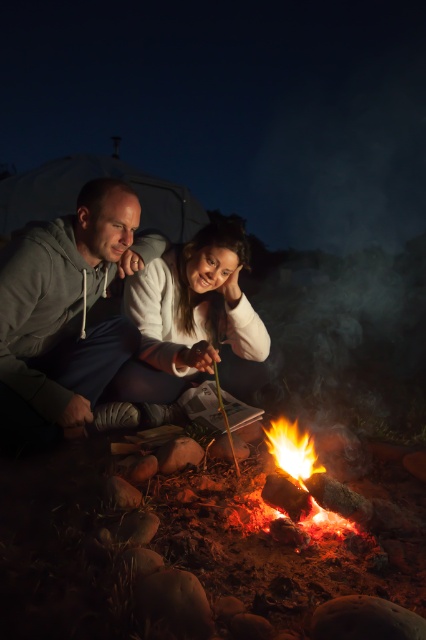
Question: Among these objects, which one is nearest to the camera?

Choices:
 (A) flaming wood at center
 (B) gray hoodie at left

Answer: (A)

Question: Is gray hoodie at left closer to the viewer compared to white soft sweater at center?

Choices:
 (A) yes
 (B) no

Answer: (A)

Question: Which of these objects is positioned closest to the flaming wood at center?

Choices:
 (A) gray hoodie at left
 (B) white soft sweater at center

Answer: (B)

Question: Is the position of white soft sweater at center more distant than that of flaming wood at center?

Choices:
 (A) no
 (B) yes

Answer: (B)

Question: Is white soft sweater at center further to the viewer compared to flaming wood at center?

Choices:
 (A) no
 (B) yes

Answer: (B)

Question: Which point appears farthest from the camera in this image?

Choices:
 (A) (x=31, y=236)
 (B) (x=319, y=493)

Answer: (A)